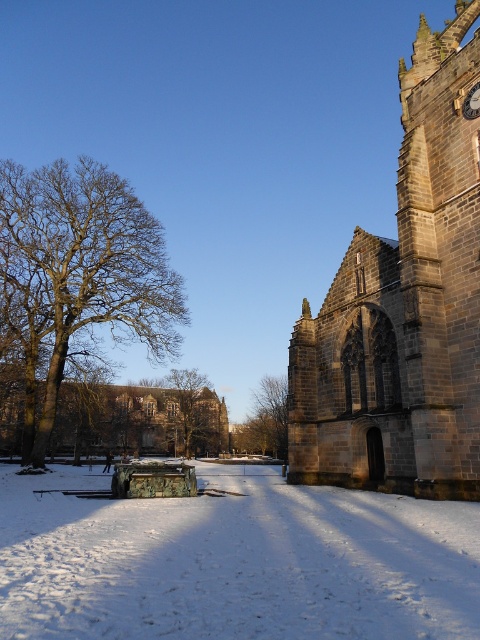
Question: Among these points, which one is nearest to the camera?

Choices:
 (A) (454, 390)
 (B) (101, 248)
 (C) (471, 88)

Answer: (A)

Question: Does white powdery snow at center have a greater width compared to brown stone church at right?

Choices:
 (A) no
 (B) yes

Answer: (A)

Question: Is brown leafless tree at left smaller than gold metallic clock at upper right?

Choices:
 (A) no
 (B) yes

Answer: (A)

Question: Which object appears closest to the camera in this image?

Choices:
 (A) green leafy tree at center
 (B) gold metallic clock at upper right
 (C) white powdery snow at center

Answer: (C)

Question: Which point is closer to the camera?

Choices:
 (A) (265, 436)
 (B) (417, 550)
 (C) (132, 266)
 (D) (191, 369)

Answer: (B)

Question: Does brown leafless tree at center have a smaller size compared to gold metallic clock at upper right?

Choices:
 (A) yes
 (B) no

Answer: (B)